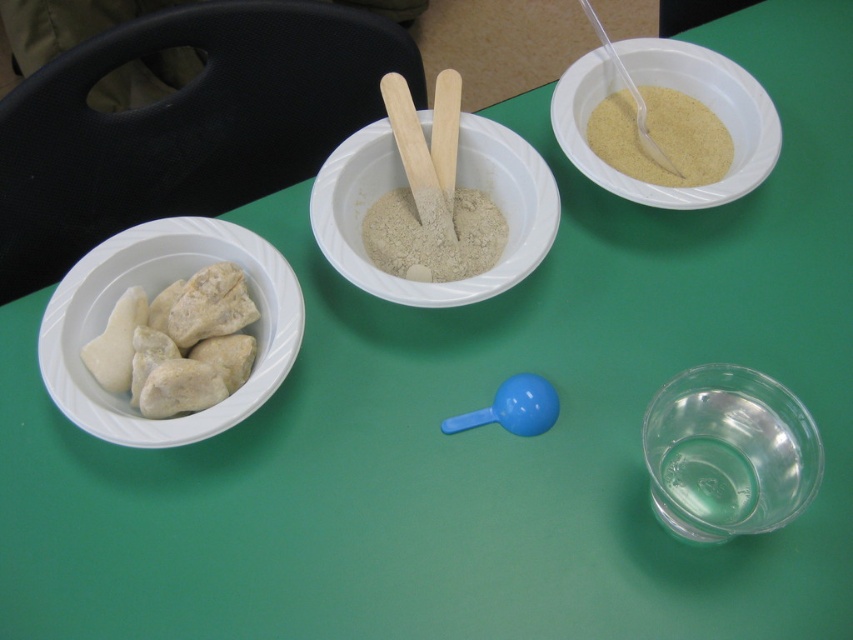
Question: Can you confirm if yellowish powder at upper right is positioned to the right of white powdery sand at center?

Choices:
 (A) no
 (B) yes

Answer: (B)

Question: Which object is farther from the camera taking this photo?

Choices:
 (A) transparent plastic bowl at lower right
 (B) smooth beige powder at center
 (C) yellowish powder at upper right

Answer: (C)

Question: Is white stone rocks at left wider than white powdery sand at center?

Choices:
 (A) no
 (B) yes

Answer: (B)

Question: Which point is farther from the camera taking this photo?

Choices:
 (A) (383, 154)
 (B) (756, 428)
 (C) (724, 92)

Answer: (C)

Question: Estimate the real-world distances between objects in this image. Which object is farther from the white powdery sand at center?

Choices:
 (A) white matte stones at left
 (B) transparent plastic bowl at lower right
 (C) matte plastic bowl at upper right
 (D) smooth beige powder at center

Answer: (B)

Question: Does white matte stones at left lie in front of white powdery sand at center?

Choices:
 (A) no
 (B) yes

Answer: (B)